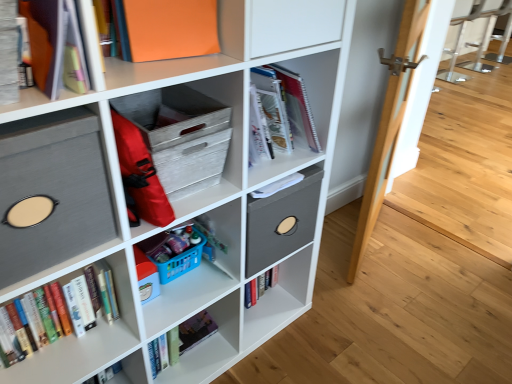
Question: Can you confirm if matte orange folder at upper left, the first shelf viewed from the top, is thinner than hardcover books at left?

Choices:
 (A) yes
 (B) no

Answer: (B)

Question: From a real-world perspective, is matte orange folder at upper left, marked as the 4th shelf in a bottom-to-top arrangement, located higher than hardcover books at left?

Choices:
 (A) yes
 (B) no

Answer: (A)

Question: From the image's perspective, is matte orange folder at upper left, marked as the 4th shelf in a bottom-to-top arrangement, located above hardcover books at left?

Choices:
 (A) no
 (B) yes

Answer: (B)

Question: Does matte orange folder at upper left, the first shelf viewed from the top, have a lesser height compared to hardcover books at left?

Choices:
 (A) yes
 (B) no

Answer: (B)

Question: Can you confirm if matte orange folder at upper left, the first shelf viewed from the top, is smaller than hardcover books at left?

Choices:
 (A) yes
 (B) no

Answer: (A)

Question: From the image's perspective, is matte orange folder at upper left, marked as the 4th shelf in a bottom-to-top arrangement, located beneath hardcover books at left?

Choices:
 (A) yes
 (B) no

Answer: (B)

Question: Is gray fabric storage bin at left, which ranks as the third shelf in top-to-bottom order, turned away from wooden crate at center, placed as the second shelf when sorted from top to bottom?

Choices:
 (A) no
 (B) yes

Answer: (A)

Question: Does gray fabric storage bin at left, placed as the second shelf when sorted from bottom to top, come in front of wooden crate at center, acting as the third shelf starting from the bottom?

Choices:
 (A) no
 (B) yes

Answer: (B)

Question: From the image's perspective, is gray fabric storage bin at left, which ranks as the third shelf in top-to-bottom order, located beneath wooden crate at center, acting as the third shelf starting from the bottom?

Choices:
 (A) no
 (B) yes

Answer: (B)

Question: Is gray fabric storage bin at left, which ranks as the third shelf in top-to-bottom order, bigger than wooden crate at center, acting as the third shelf starting from the bottom?

Choices:
 (A) no
 (B) yes

Answer: (B)

Question: Considering the relative sizes of gray fabric storage bin at left, which ranks as the third shelf in top-to-bottom order, and wooden crate at center, acting as the third shelf starting from the bottom, in the image provided, is gray fabric storage bin at left, which ranks as the third shelf in top-to-bottom order, wider than wooden crate at center, acting as the third shelf starting from the bottom,?

Choices:
 (A) yes
 (B) no

Answer: (B)

Question: Is gray fabric storage bin at left, which ranks as the third shelf in top-to-bottom order, not inside wooden crate at center, acting as the third shelf starting from the bottom?

Choices:
 (A) yes
 (B) no

Answer: (A)

Question: Can you confirm if gray fabric storage bin at left, which ranks as the third shelf in top-to-bottom order, is wider than hardcover books at left?

Choices:
 (A) yes
 (B) no

Answer: (A)